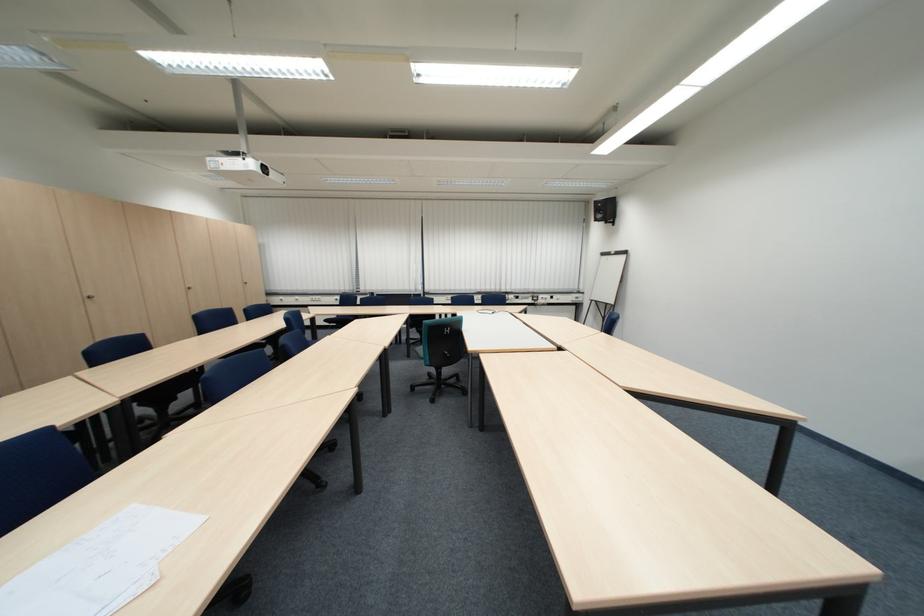
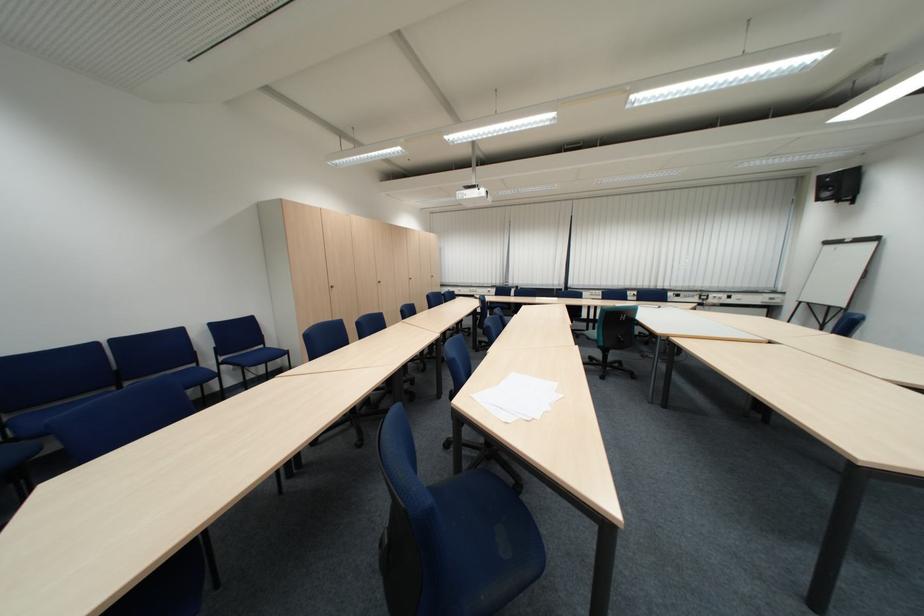
The images are taken continuously from a first-person perspective. In which direction are you moving?

The cameraman moved toward left, backward.